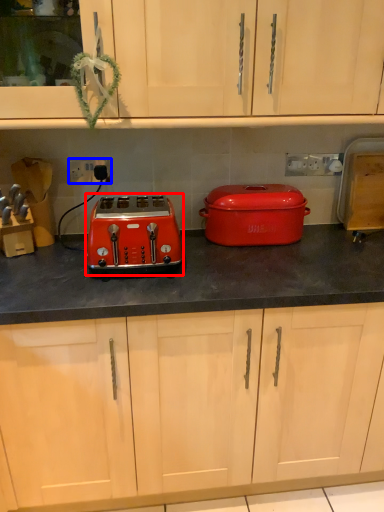
Question: Which of the following is the closest to the observer, toaster (highlighted by a red box) or electric outlet (highlighted by a blue box)?

Choices:
 (A) toaster
 (B) electric outlet

Answer: (A)